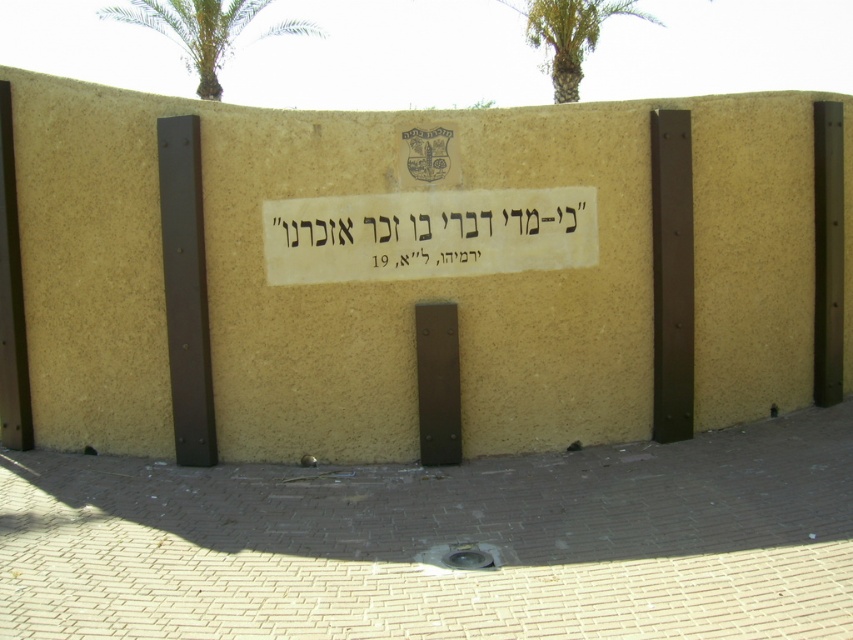
Question: Can you confirm if white paper sign at center is positioned above green leafy palm tree at upper left?

Choices:
 (A) yes
 (B) no

Answer: (B)

Question: Which point is closer to the camera?

Choices:
 (A) (379, 225)
 (B) (143, 16)

Answer: (A)

Question: Which point is closer to the camera?

Choices:
 (A) white paper sign at center
 (B) green leafy palm tree at upper center
 (C) green leafy palm tree at upper left

Answer: (A)

Question: Which point is farther to the camera?

Choices:
 (A) coord(207,58)
 (B) coord(544,45)

Answer: (B)

Question: Does white paper sign at center have a smaller size compared to green leafy palm tree at upper left?

Choices:
 (A) no
 (B) yes

Answer: (B)

Question: Is green leafy palm tree at upper left thinner than green leafy palm tree at upper center?

Choices:
 (A) yes
 (B) no

Answer: (B)